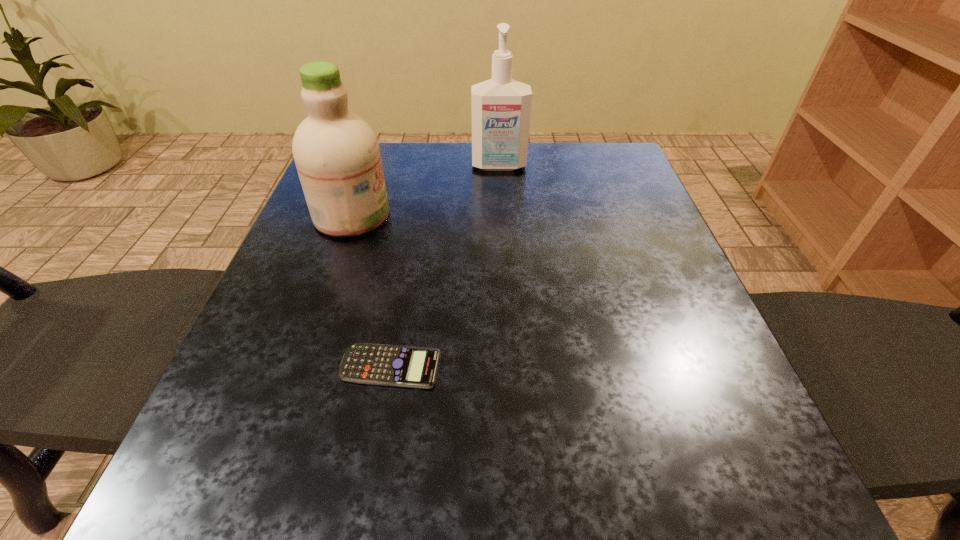
At what (x,y) coordinates should I click in order to perform the action: click on the right cleansing agent. Please return your answer as a coordinate pair (x, y). This screenshot has width=960, height=540. Looking at the image, I should click on [x=501, y=107].

Locate an element on the screen. The image size is (960, 540). the farther cleansing agent is located at coordinates (501, 107).

Find the location of `the left cleansing agent`. the left cleansing agent is located at coordinates (336, 152).

Where is `the nearer cleansing agent`? This screenshot has height=540, width=960. the nearer cleansing agent is located at coordinates (336, 152).

At what (x,y) coordinates should I click in order to perform the action: click on the shortest object. Please return your answer as a coordinate pair (x, y). The width and height of the screenshot is (960, 540). Looking at the image, I should click on (377, 364).

Find the location of a particular element. The width and height of the screenshot is (960, 540). the nearest object is located at coordinates (377, 364).

Locate an element on the screen. vacant space situated on the front label of the farther cleansing agent is located at coordinates (501, 205).

Locate an element on the screen. The height and width of the screenshot is (540, 960). blank space located 0.190m on the front label of the left cleansing agent is located at coordinates (477, 215).

Locate an element on the screen. The width and height of the screenshot is (960, 540). free point located on the back of the nearest object is located at coordinates (412, 245).

You are a GUI agent. You are given a task and a screenshot of the screen. Output one action in this format:
    pyautogui.click(x=<x>, y=<y>)
    Task: Click on the object positioned at the far edge
    
    Given the screenshot: What is the action you would take?
    pyautogui.click(x=501, y=107)